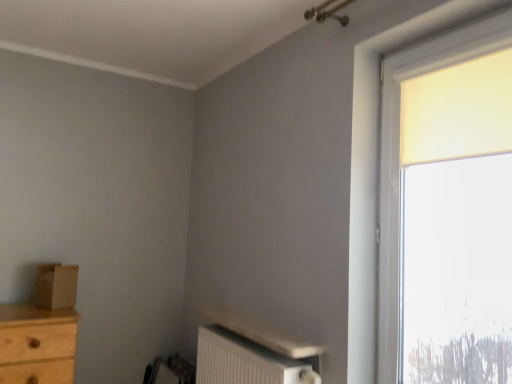
Question: Can you confirm if matte yellow curtain at upper right is positioned to the left of brown cardboard box at left?

Choices:
 (A) yes
 (B) no

Answer: (B)

Question: Considering the relative sizes of matte yellow curtain at upper right and brown cardboard box at left in the image provided, is matte yellow curtain at upper right smaller than brown cardboard box at left?

Choices:
 (A) yes
 (B) no

Answer: (B)

Question: Is matte yellow curtain at upper right oriented towards brown cardboard box at left?

Choices:
 (A) yes
 (B) no

Answer: (B)

Question: Can you confirm if matte yellow curtain at upper right is taller than brown cardboard box at left?

Choices:
 (A) no
 (B) yes

Answer: (B)

Question: Can you confirm if matte yellow curtain at upper right is wider than brown cardboard box at left?

Choices:
 (A) yes
 (B) no

Answer: (B)

Question: Are matte yellow curtain at upper right and brown cardboard box at left making contact?

Choices:
 (A) yes
 (B) no

Answer: (B)

Question: From a real-world perspective, is white textured radiator at lower center located beneath brown cardboard box at left?

Choices:
 (A) yes
 (B) no

Answer: (A)

Question: Can you confirm if white textured radiator at lower center is positioned to the left of brown cardboard box at left?

Choices:
 (A) no
 (B) yes

Answer: (A)

Question: Considering the relative sizes of white textured radiator at lower center and brown cardboard box at left in the image provided, is white textured radiator at lower center taller than brown cardboard box at left?

Choices:
 (A) no
 (B) yes

Answer: (B)

Question: Does white textured radiator at lower center lie behind brown cardboard box at left?

Choices:
 (A) no
 (B) yes

Answer: (A)

Question: Does white textured radiator at lower center turn towards brown cardboard box at left?

Choices:
 (A) yes
 (B) no

Answer: (B)

Question: Would you consider white textured radiator at lower center to be distant from brown cardboard box at left?

Choices:
 (A) no
 (B) yes

Answer: (A)

Question: From a real-world perspective, is brown cardboard box at left beneath matte yellow curtain at upper right?

Choices:
 (A) yes
 (B) no

Answer: (A)